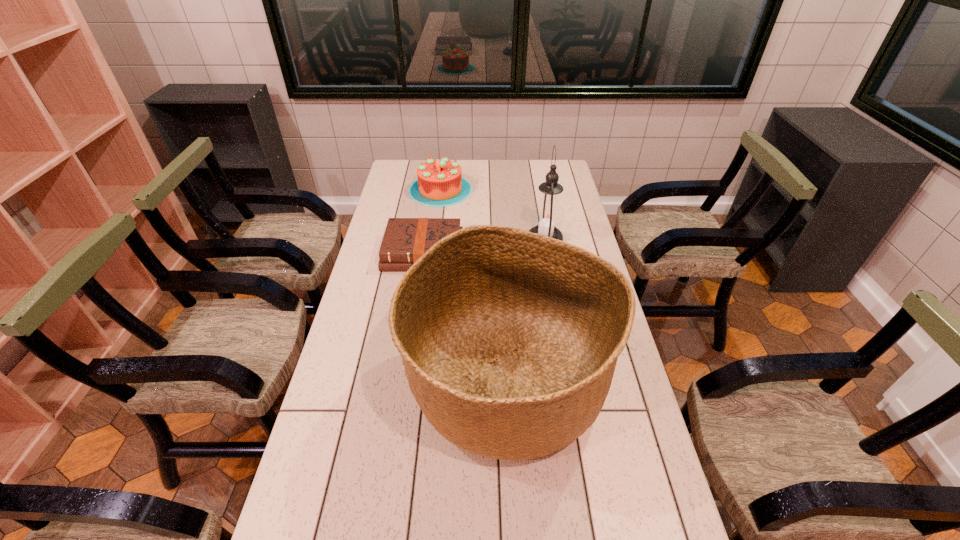
Locate an element on the screen. oil lamp is located at coordinates (547, 216).

Where is `basket`? Image resolution: width=960 pixels, height=540 pixels. basket is located at coordinates (510, 339).

Find the location of `the second shortest object`. the second shortest object is located at coordinates (440, 183).

The height and width of the screenshot is (540, 960). Identify the location of cake. (440, 183).

Where is `hardback book`? The height and width of the screenshot is (540, 960). hardback book is located at coordinates click(x=405, y=240).

Where is `vacant position located on the left of the oil lamp`? This screenshot has height=540, width=960. vacant position located on the left of the oil lamp is located at coordinates (474, 239).

The width and height of the screenshot is (960, 540). I want to click on vacant space located on the left of the basket, so click(355, 384).

This screenshot has width=960, height=540. Identify the location of vacant space situated on the front of the farthest object. (431, 265).

Where is `free region located on the left of the shortest object`? This screenshot has width=960, height=540. free region located on the left of the shortest object is located at coordinates (368, 252).

This screenshot has width=960, height=540. In order to click on object that is at the far edge in this screenshot , I will do `click(440, 183)`.